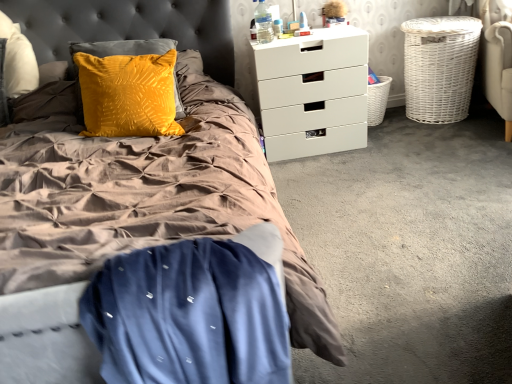
Question: Is point (268, 19) positioned closer to the camera than point (388, 92)?

Choices:
 (A) closer
 (B) farther

Answer: (A)

Question: Looking at their shapes, would you say clear plastic water bottle at upper right is wider or thinner than white wicker basket at lower right, which is the 1th basket from left to right?

Choices:
 (A) wide
 (B) thin

Answer: (B)

Question: Estimate the real-world distances between objects in this image. Which object is farther from the white wicker basket at right, positioned as the first basket in right-to-left order?

Choices:
 (A) velvet mustard pillow at upper left
 (B) white wicker basket at lower right, which ranks as the second basket in right-to-left order
 (C) white matte chest of drawers at upper right
 (D) blue satin blanket at lower left
 (E) velvet yellow pillow at upper left

Answer: (D)

Question: Based on their relative distances, which object is farther from the blue satin blanket at lower left?

Choices:
 (A) white wicker basket at right, positioned as the first basket in right-to-left order
 (B) velvet mustard pillow at upper left
 (C) velvet yellow pillow at upper left
 (D) white matte chest of drawers at upper right
 (E) white wicker basket at lower right, which is the 1th basket from left to right

Answer: (A)